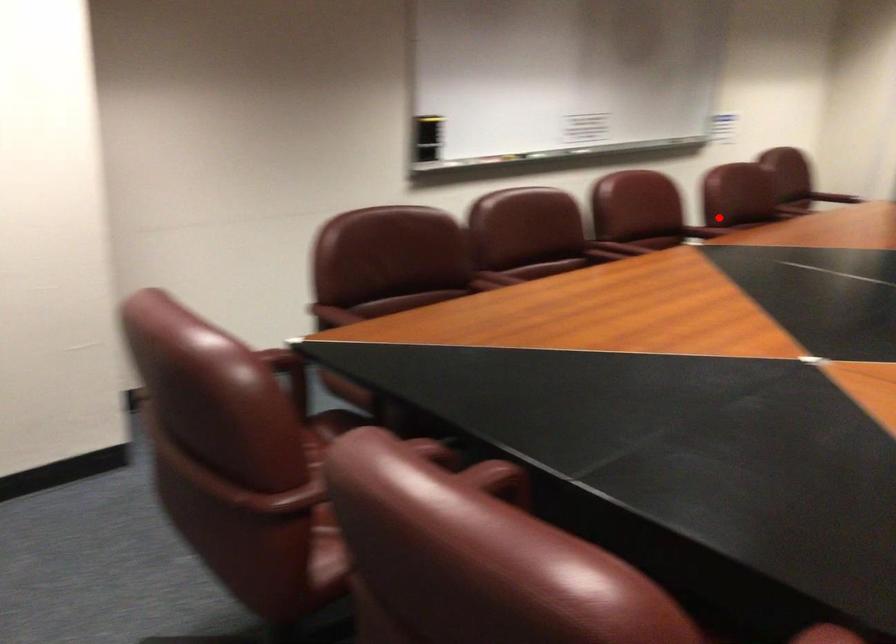
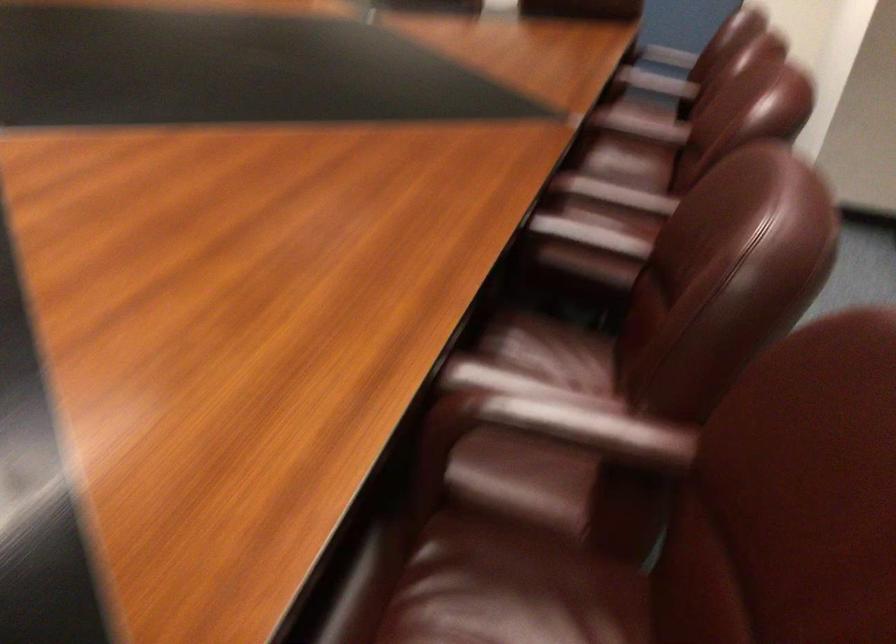
Question: I am providing you with two images of the same scene from different viewpoints. Given a red point in image1, look at the same physical point in image2. Is it:

Choices:
 (A) Closer to the viewpoint
 (B) Farther from the viewpoint

Answer: (A)